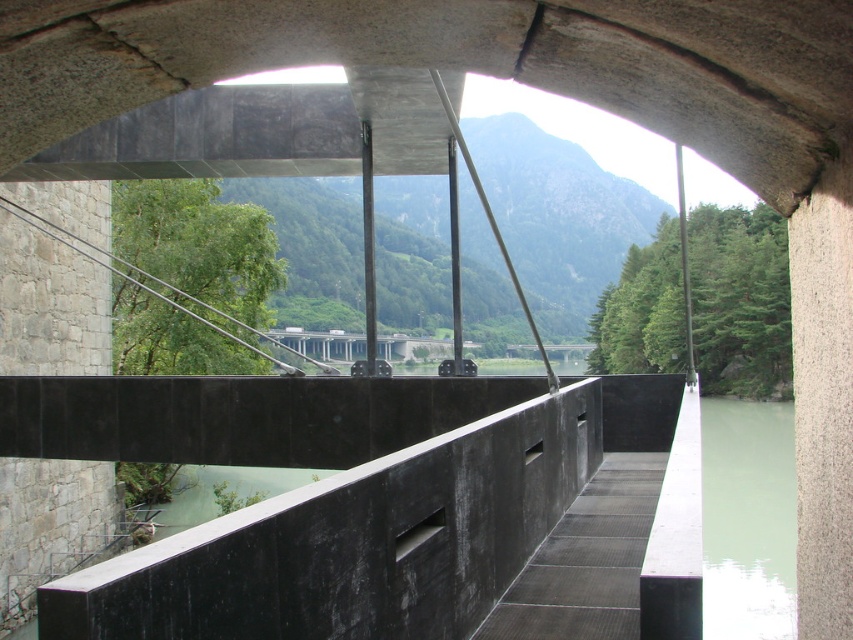
Question: Does greenish concrete river at right have a larger size compared to green concrete river at lower center?

Choices:
 (A) yes
 (B) no

Answer: (A)

Question: Is greenish concrete river at right above green concrete river at lower center?

Choices:
 (A) yes
 (B) no

Answer: (A)

Question: Which point appears closest to the camera in this image?

Choices:
 (A) (734, 568)
 (B) (292, 486)

Answer: (A)

Question: Is greenish concrete river at right below green concrete river at lower center?

Choices:
 (A) no
 (B) yes

Answer: (A)

Question: Among these objects, which one is farthest from the camera?

Choices:
 (A) greenish concrete river at right
 (B) green concrete river at lower center

Answer: (B)

Question: Which point appears farthest from the camera in this image?

Choices:
 (A) (706, 518)
 (B) (178, 502)

Answer: (A)